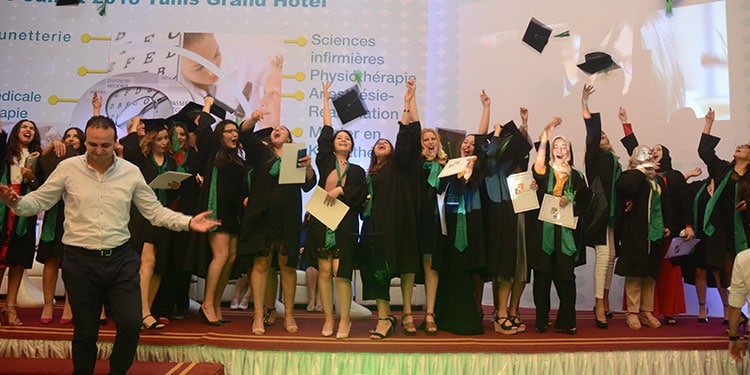
Locate an element on the screen. projector screen is located at coordinates (655, 41).